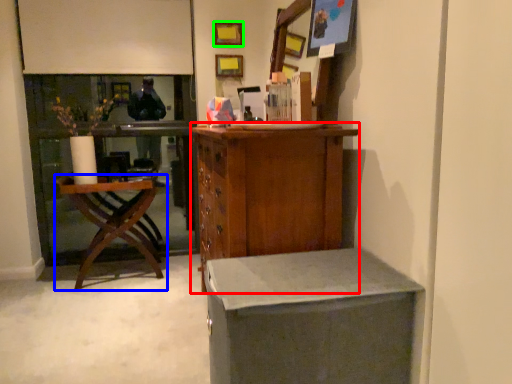
Question: Based on their relative distances, which object is nearer to cabinetry (highlighted by a red box)? Choose from chair (highlighted by a blue box) and picture frame (highlighted by a green box).

Choices:
 (A) chair
 (B) picture frame

Answer: (A)